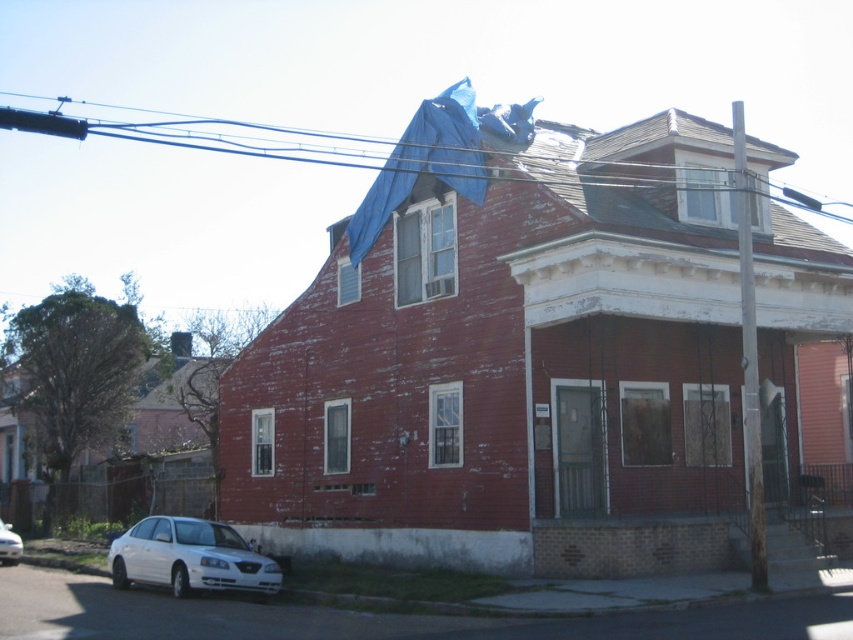
You are standing at the center of the image. Which direction should you walk to reach the white matte sedan at lower left?

You should walk towards the lower left direction to reach the white matte sedan at lower left.